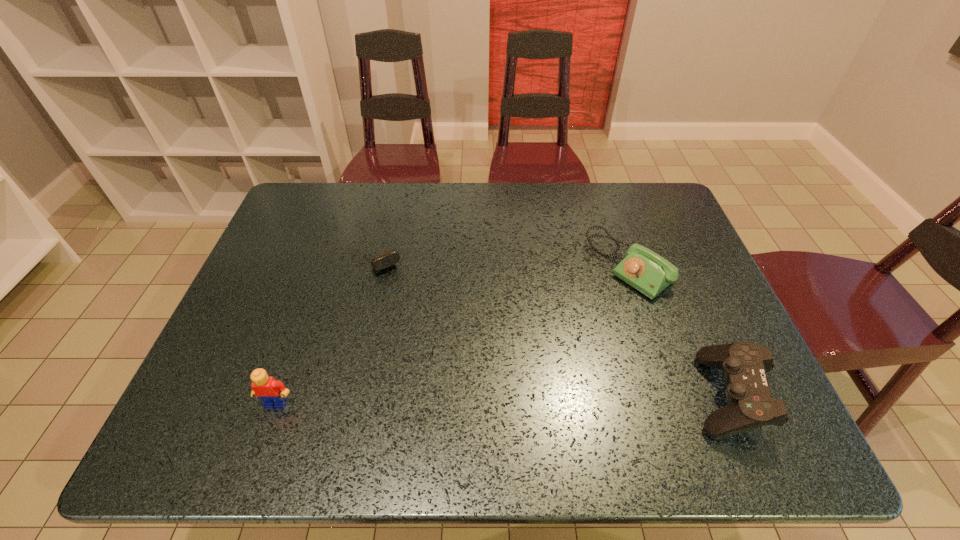
This screenshot has width=960, height=540. I want to click on object present at the near right corner, so click(x=744, y=364).

You are a GUI agent. You are given a task and a screenshot of the screen. Output one action in this format:
    pyautogui.click(x=<x>, y=<y>)
    Task: Click on the free space at the far edge of the desktop
    The image size is (960, 540).
    Given the screenshot: What is the action you would take?
    pyautogui.click(x=366, y=201)

Where is `vacant space at the near edge`? vacant space at the near edge is located at coordinates (295, 399).

In the image, there is a desktop. What are the coordinates of `free space at the left edge` in the screenshot? It's located at (238, 326).

You are a GUI agent. You are given a task and a screenshot of the screen. Output one action in this format:
    pyautogui.click(x=<x>, y=<y>)
    Task: Click on the free region at the near left corner of the desktop
    This screenshot has height=540, width=960.
    Given the screenshot: What is the action you would take?
    (x=229, y=396)

You are a GUI agent. You are given a task and a screenshot of the screen. Output one action in this format:
    pyautogui.click(x=<x>, y=<y>)
    Task: Click on the free space at the far right corner of the desktop
    The height and width of the screenshot is (540, 960).
    Given the screenshot: What is the action you would take?
    pyautogui.click(x=645, y=185)

Where is `blank space at the near right corner of the desktop`? The height and width of the screenshot is (540, 960). blank space at the near right corner of the desktop is located at coordinates (710, 400).

Locate an element on the screen. free space between the leftmost object and the telephone is located at coordinates (452, 334).

Where is `empty space between the control and the shortest object`? The height and width of the screenshot is (540, 960). empty space between the control and the shortest object is located at coordinates (551, 322).

The width and height of the screenshot is (960, 540). In order to click on free area in between the leftmost object and the telephone in this screenshot , I will do `click(452, 334)`.